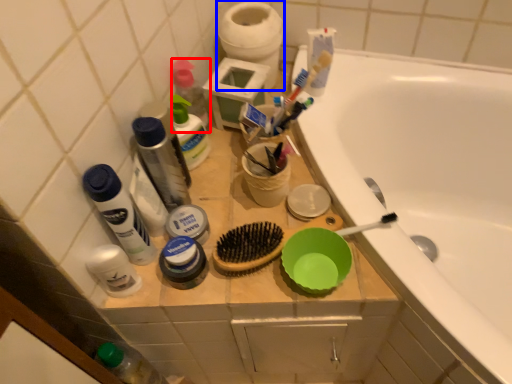
Question: Among these objects, which one is farthest to the camera, toiletry (highlighted by a red box) or toilet paper (highlighted by a blue box)?

Choices:
 (A) toiletry
 (B) toilet paper

Answer: (B)